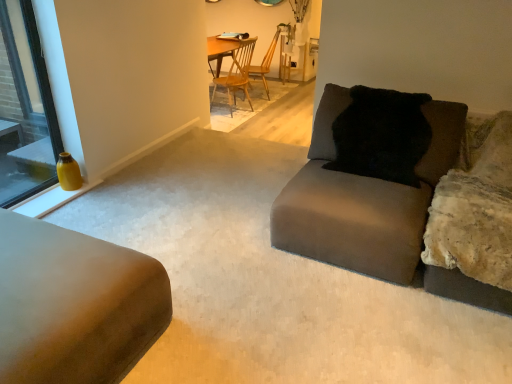
Question: From the image's perspective, relative to matte gray couch at center, the 2th studio couch positioned from the left, is matte yellow vase at left above or below?

Choices:
 (A) below
 (B) above

Answer: (B)

Question: Is matte yellow vase at left inside or outside of matte gray couch at center, the 2th studio couch positioned from the left?

Choices:
 (A) outside
 (B) inside

Answer: (A)

Question: Which is nearer to the black fuzzy pillow at upper right?

Choices:
 (A) matte gray couch at center, acting as the 1th studio couch starting from the right
 (B) matte yellow vase at left
 (C) wooden chair at center, which appears as the first chair when viewed from the back
 (D) wooden at center, placed as the first chair when sorted from front to back
 (E) suede-like beige couch at lower left, which is counted as the 2th studio couch, starting from the right

Answer: (A)

Question: Based on their relative distances, which object is nearer to the suede-like beige couch at lower left, which is the 1th studio couch from left to right?

Choices:
 (A) wooden chair at center, which appears as the first chair when viewed from the back
 (B) matte gray couch at center, the 2th studio couch positioned from the left
 (C) matte yellow vase at left
 (D) black fuzzy pillow at upper right
 (E) wooden at center, arranged as the second chair when viewed from the back

Answer: (B)